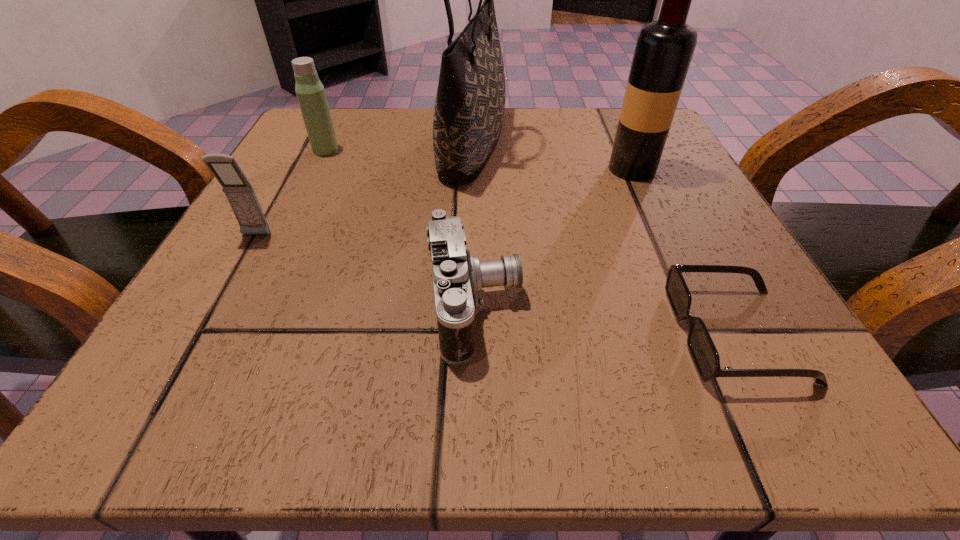
This screenshot has height=540, width=960. What are the coordinates of `unoccupied position between the third shortest object and the thermos bottle` in the screenshot? It's located at (291, 193).

Where is `the second closest object relative to the wine bottle`? Image resolution: width=960 pixels, height=540 pixels. the second closest object relative to the wine bottle is located at coordinates (705, 356).

Select which object appears as the second closest to the camera. Please provide its 2D coordinates. Your answer should be formatted as a tuple, i.e. [(x, y)], where the tuple contains the x and y coordinates of a point satisfying the conditions above.

[(705, 356)]